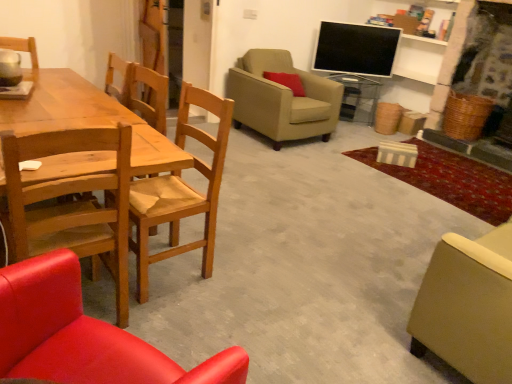
Find the location of a particular element. The height and width of the screenshot is (384, 512). vacant region in front of transparent glass side table at center is located at coordinates (352, 127).